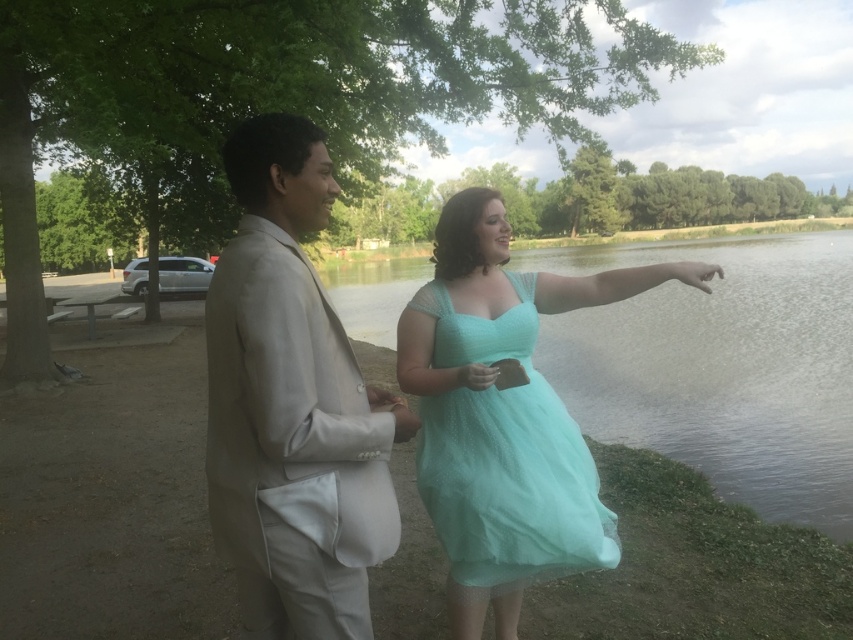
Does point (552, 484) come closer to viewer compared to point (451, 556)?

Yes.

Is mint tulle dress at center taller than tulle dress at center?

Correct, mint tulle dress at center is much taller as tulle dress at center.

Does point (527, 364) lie in front of point (538, 385)?

Yes, point (527, 364) is closer to viewer.

Where is `mint tulle dress at center`? The image size is (853, 640). mint tulle dress at center is located at coordinates (503, 416).

Which is in front, point (254, 384) or point (535, 321)?

Positioned in front is point (254, 384).

Does satin beige suit at left have a larger size compared to mint tulle dress at center?

Actually, satin beige suit at left might be smaller than mint tulle dress at center.

Does point (212, 332) come behind point (432, 509)?

That is False.

This screenshot has width=853, height=640. What are the coordinates of `satin beige suit at left` in the screenshot? It's located at (292, 404).

Who is positioned more to the right, satin beige suit at left or tulle dress at center?

From the viewer's perspective, tulle dress at center appears more on the right side.

Does satin beige suit at left have a larger size compared to tulle dress at center?

Correct, satin beige suit at left is larger in size than tulle dress at center.

Find the location of a particular element. satin beige suit at left is located at coordinates (292, 404).

The image size is (853, 640). What are the coordinates of `satin beige suit at left` in the screenshot? It's located at (292, 404).